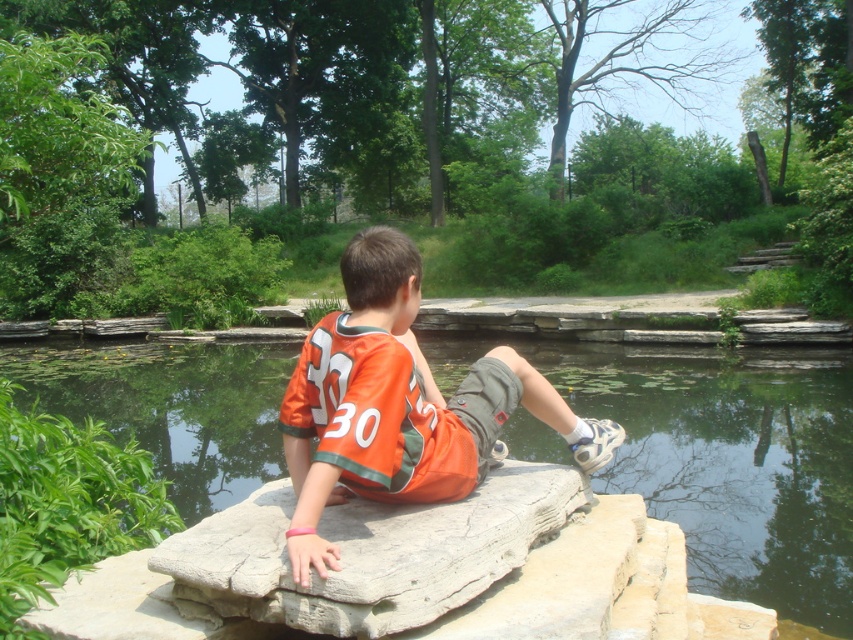
Question: Is the position of greenish water at center more distant than that of orange jersey at center?

Choices:
 (A) yes
 (B) no

Answer: (A)

Question: Is greenish water at center above orange jersey at center?

Choices:
 (A) yes
 (B) no

Answer: (B)

Question: Which point is closer to the camera?

Choices:
 (A) (509, 403)
 (B) (717, 561)

Answer: (A)

Question: Which object is farther from the camera taking this photo?

Choices:
 (A) greenish water at center
 (B) orange jersey at center

Answer: (A)

Question: Is greenish water at center to the right of orange jersey at center from the viewer's perspective?

Choices:
 (A) no
 (B) yes

Answer: (A)